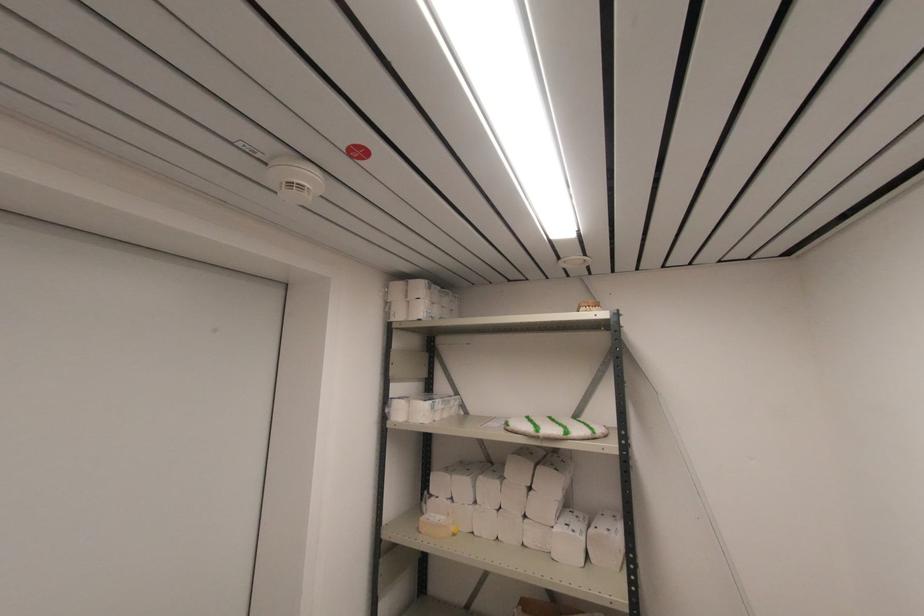
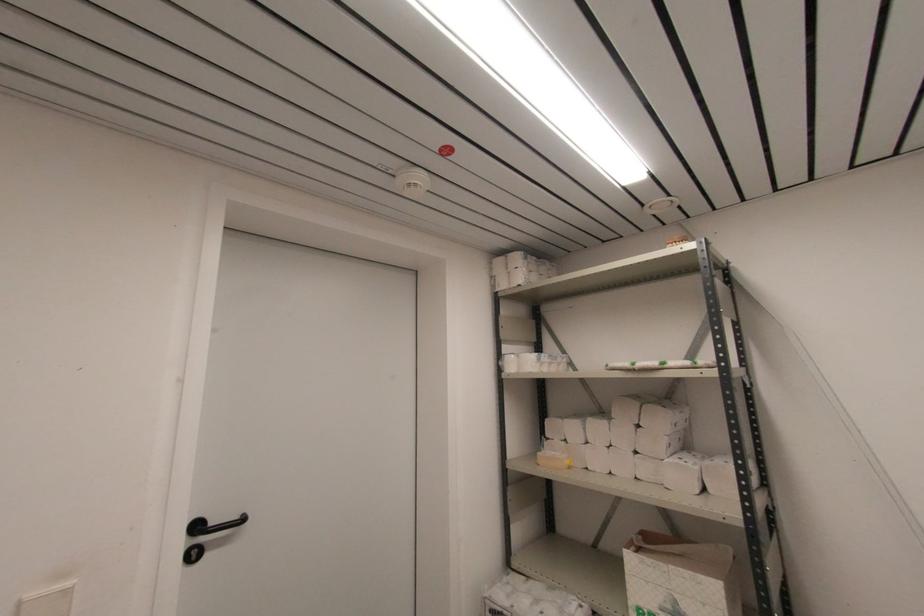
Where in the second image is the point corresponding to the point at 420,533 from the first image?

(540, 464)